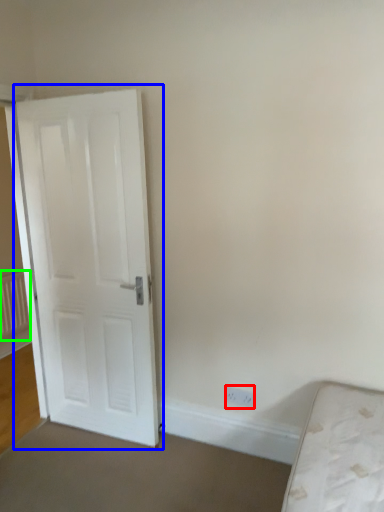
Question: Considering the real-world distances, which object is closest to electric outlet (highlighted by a red box)? door (highlighted by a blue box) or radiator (highlighted by a green box).

Choices:
 (A) door
 (B) radiator

Answer: (A)